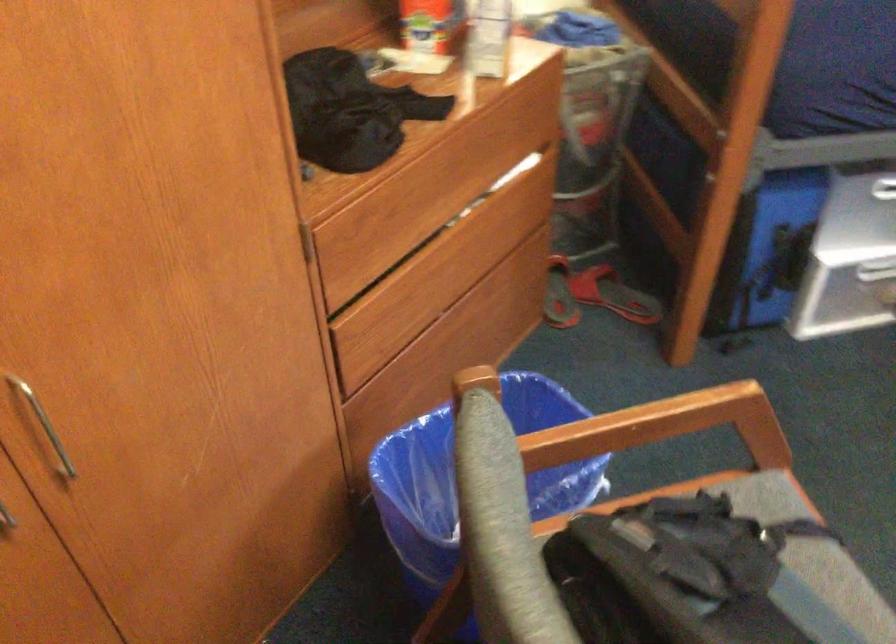
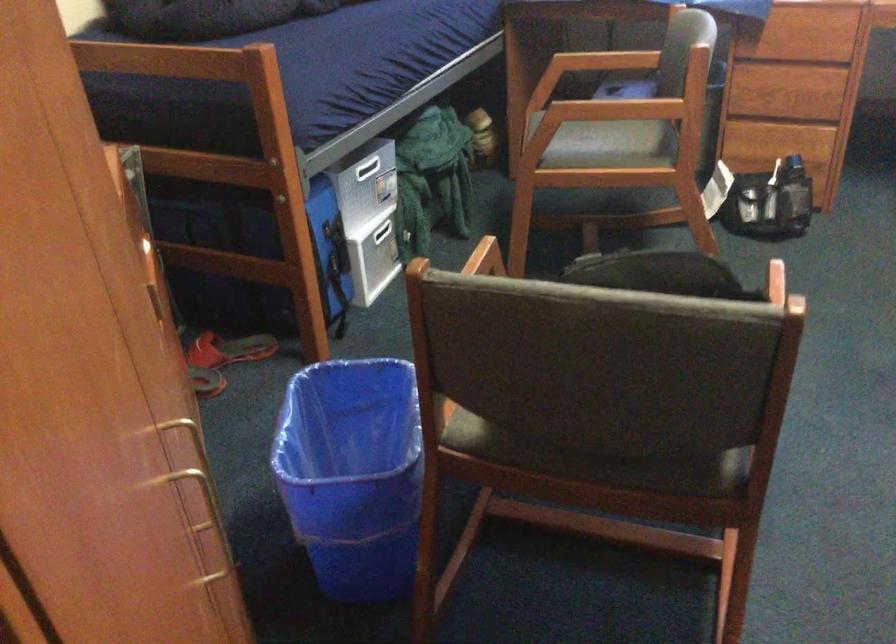
Question: The camera is either moving clockwise (left) or counter-clockwise (right) around the object. The first image is from the beginning of the video and the second image is from the end. Is the camera moving left or right when shooting the video?

Choices:
 (A) Left
 (B) Right

Answer: (A)